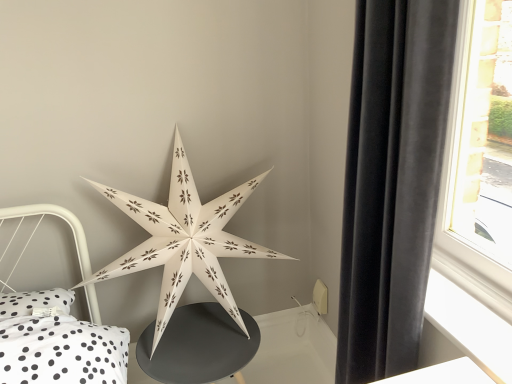
Question: In the image, is white paper star at center on the left side or the right side of velvet black curtain at right?

Choices:
 (A) left
 (B) right

Answer: (A)

Question: In terms of width, does white paper star at center look wider or thinner when compared to velvet black curtain at right?

Choices:
 (A) thin
 (B) wide

Answer: (B)

Question: Estimate the real-world distances between objects in this image. Which object is closer to the white paper star at center?

Choices:
 (A) velvet black curtain at right
 (B) matte black table at center

Answer: (B)

Question: Estimate the real-world distances between objects in this image. Which object is closer to the matte black table at center?

Choices:
 (A) white paper star at center
 (B) velvet black curtain at right

Answer: (A)